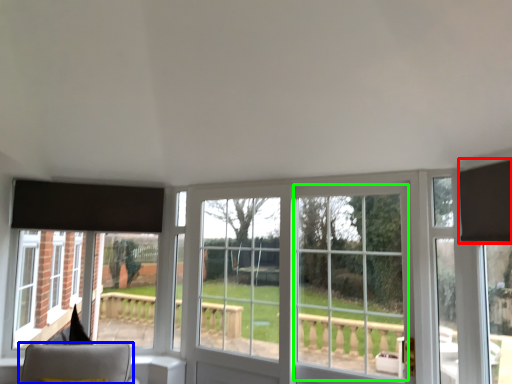
Question: Considering the real-world distances, which object is closest to curtain (highlighted by a red box)? furniture (highlighted by a blue box) or glass door (highlighted by a green box).

Choices:
 (A) furniture
 (B) glass door

Answer: (B)